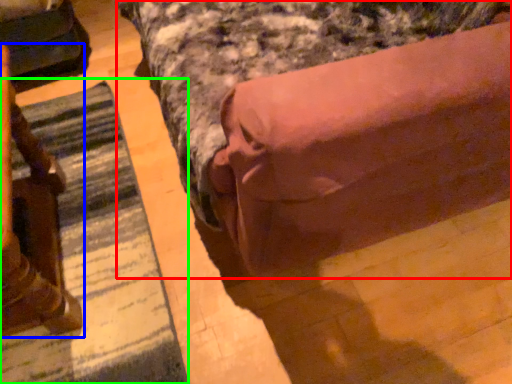
Question: Based on their relative distances, which object is farther from bed (highlighted by a red box)? Choose from furniture (highlighted by a blue box) and mat (highlighted by a green box).

Choices:
 (A) furniture
 (B) mat

Answer: (A)